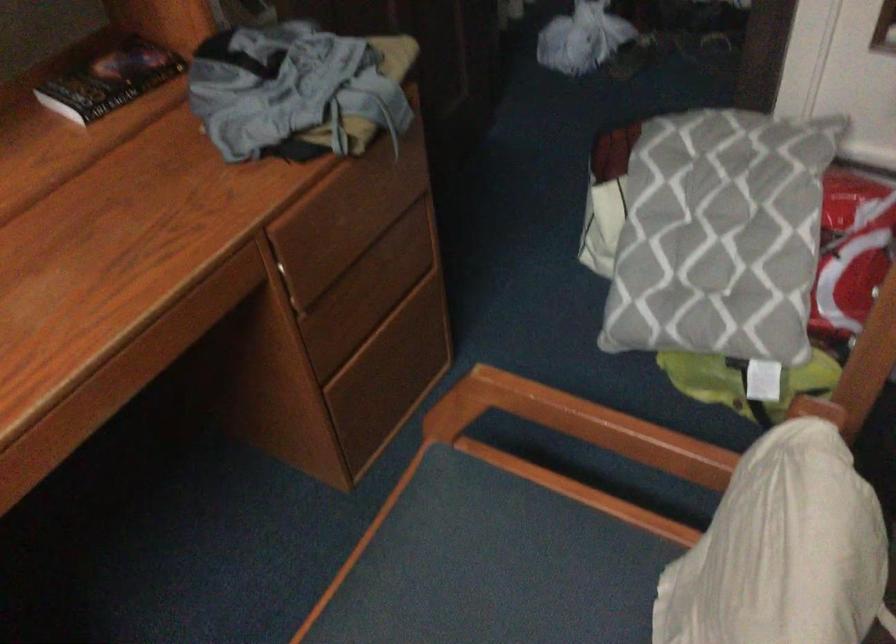
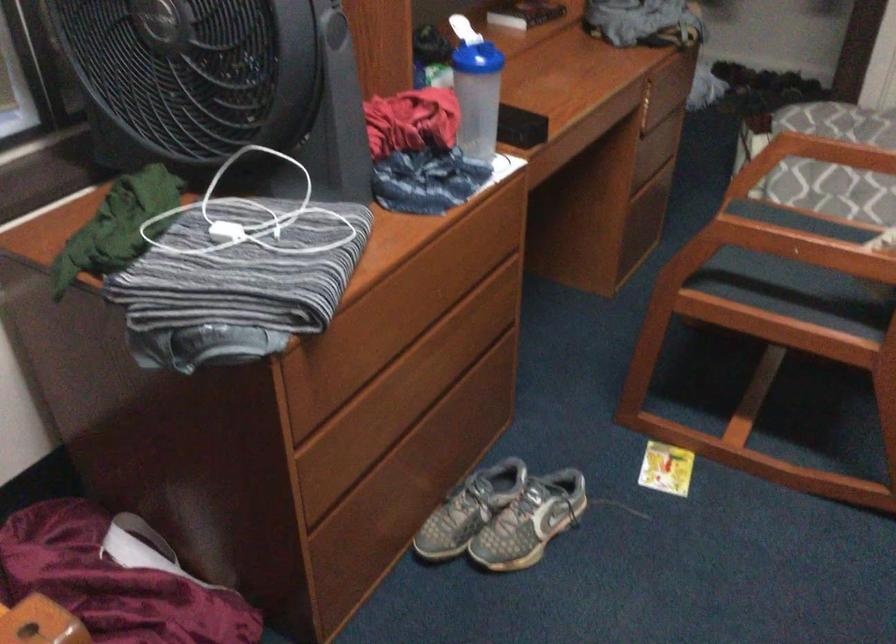
Find the pixel in the second image that matches point 341,351 in the first image.

(643, 169)